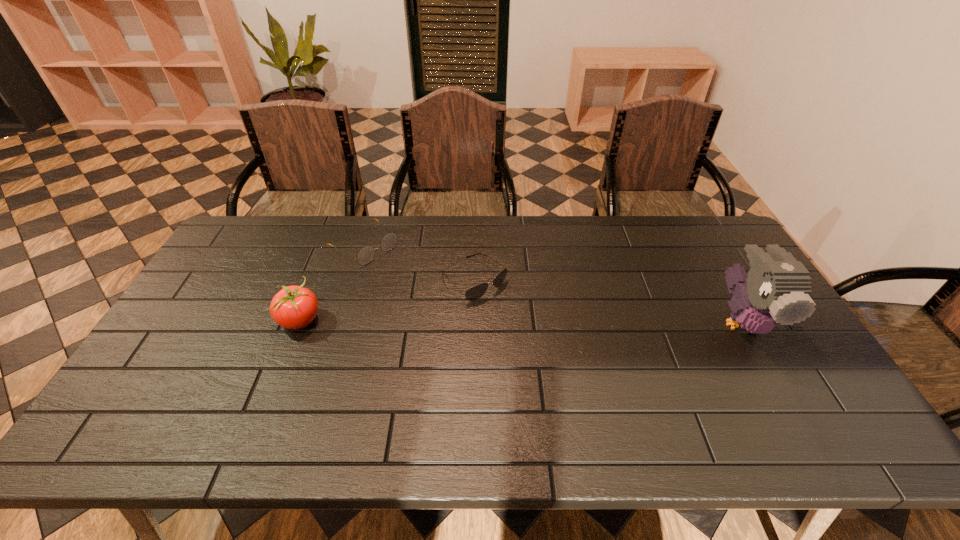
You are a GUI agent. You are given a task and a screenshot of the screen. Output one action in this format:
    pyautogui.click(x=<x>, y=<y>)
    Task: Click on the tomato
    The width and height of the screenshot is (960, 540).
    Given the screenshot: What is the action you would take?
    [294, 307]

This screenshot has width=960, height=540. In order to click on the rightmost object in this screenshot , I will do `click(777, 290)`.

The height and width of the screenshot is (540, 960). I want to click on bird, so click(x=777, y=290).

Where is `spectacles`? spectacles is located at coordinates (366, 254).

Image resolution: width=960 pixels, height=540 pixels. I want to click on sunglasses, so click(474, 293).

What are the coordinates of `vacant area situated 0.130m on the left of the third shortest object` in the screenshot? It's located at (233, 320).

The height and width of the screenshot is (540, 960). I want to click on free space located at the beak of the rightmost object, so click(777, 381).

Locate an element on the screen. This screenshot has height=540, width=960. vacant space situated 0.150m on the temples of the spectacles is located at coordinates (416, 282).

I want to click on vacant area situated 0.300m on the temples of the spectacles, so click(x=449, y=306).

Locate an element on the screen. This screenshot has height=540, width=960. vacant area located on the temples of the spectacles is located at coordinates (424, 288).